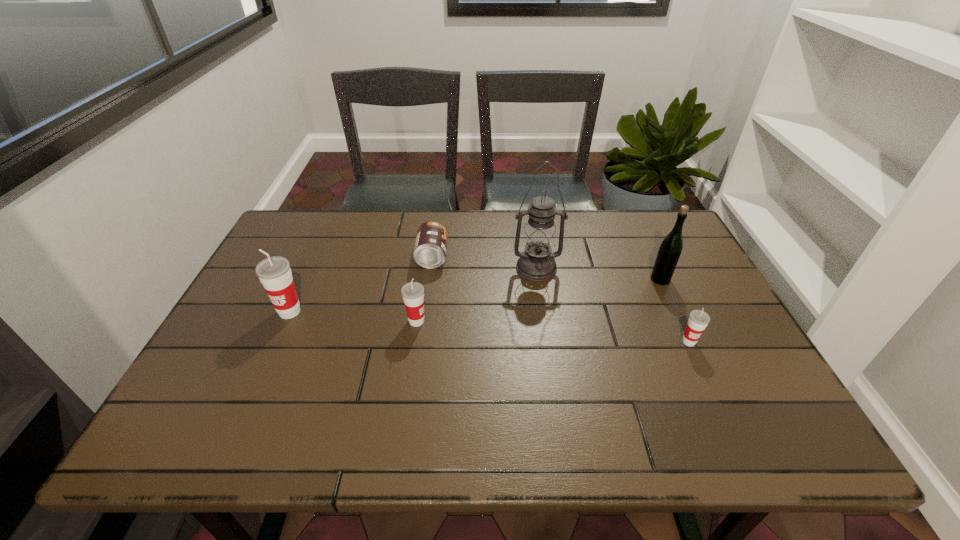
To make them evenly spaced by inserting another cup among them, please locate a free space for this new cup. Please provide its 2D coordinates. Your answer should be formatted as a tuple, i.e. [(x, y)], where the tuple contains the x and y coordinates of a point satisfying the conditions above.

[(550, 331)]